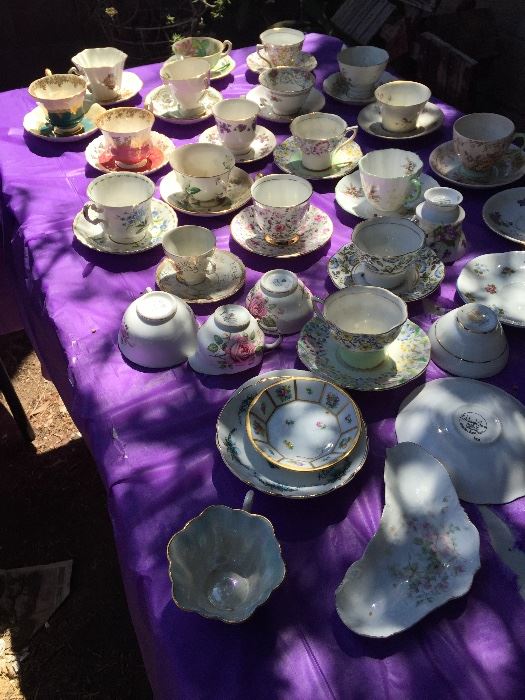
Identify the location of purple tablecloth. This screenshot has width=525, height=700. (147, 433).